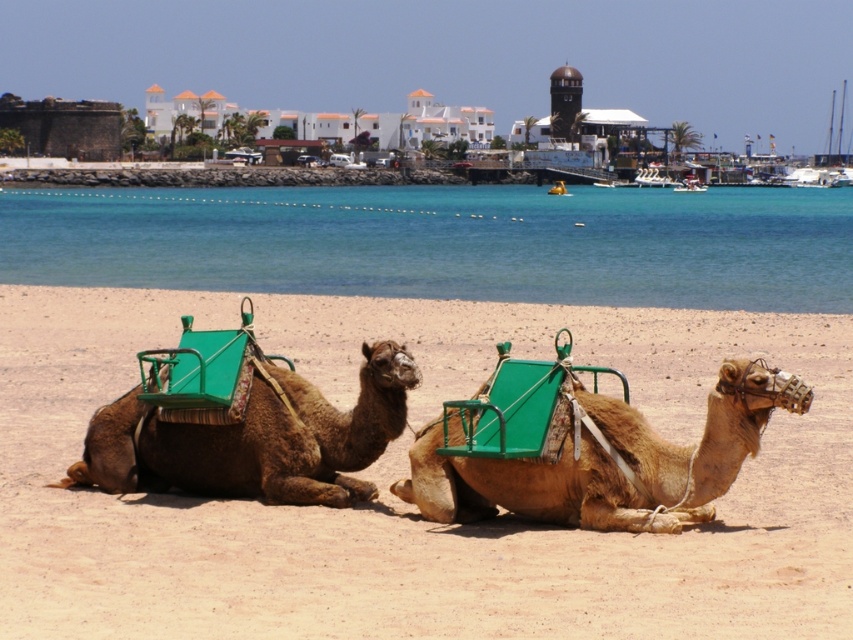
Which of these two, clear blue water at center or light brown leather camel at center, stands shorter?

light brown leather camel at center

Does clear blue water at center have a smaller size compared to light brown leather camel at center?

Incorrect, clear blue water at center is not smaller in size than light brown leather camel at center.

Locate an element on the screen. clear blue water at center is located at coordinates (445, 243).

This screenshot has height=640, width=853. Identify the location of clear blue water at center. (445, 243).

Who is more distant from viewer, [223,465] or [141,355]?

Point [141,355]

Can you confirm if brown matte camel at left is smaller than green fabric camel seat at left?

Incorrect, brown matte camel at left is not smaller in size than green fabric camel seat at left.

Does point (221, 458) come closer to viewer compared to point (289, 364)?

Yes, it is.

Identify the location of brown matte camel at left. (x=256, y=440).

Can you confirm if clear blue water at center is thinner than brown matte camel at left?

In fact, clear blue water at center might be wider than brown matte camel at left.

Is clear blue water at center taller than brown matte camel at left?

Yes.

Is point (637, 285) more distant than point (415, 365)?

Yes, point (637, 285) is farther from viewer.

You are a GUI agent. You are given a task and a screenshot of the screen. Output one action in this format:
    pyautogui.click(x=<x>, y=<y>)
    Task: Click on the clear blue water at center
    This screenshot has width=853, height=640.
    Given the screenshot: What is the action you would take?
    pyautogui.click(x=445, y=243)